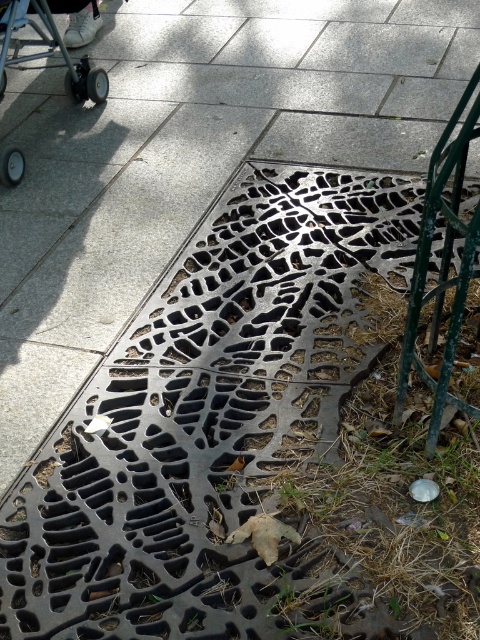
Question: Which of the following is the closest to the observer?

Choices:
 (A) green metal rail at right
 (B) black rubber wheels at upper left

Answer: (A)

Question: Is green metal rail at right to the left of black rubber wheels at upper left from the viewer's perspective?

Choices:
 (A) no
 (B) yes

Answer: (A)

Question: Which object is farther from the camera taking this photo?

Choices:
 (A) green metal rail at right
 (B) black rubber wheels at upper left

Answer: (B)

Question: In this image, where is green metal rail at right located relative to black rubber wheels at upper left?

Choices:
 (A) above
 (B) below

Answer: (B)

Question: Can you confirm if green metal rail at right is positioned above black rubber wheels at upper left?

Choices:
 (A) no
 (B) yes

Answer: (A)